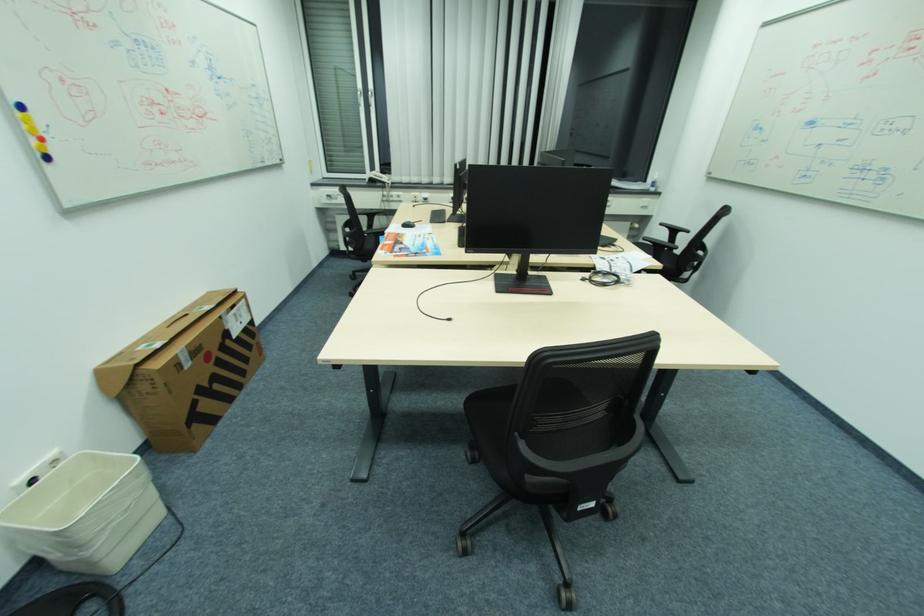
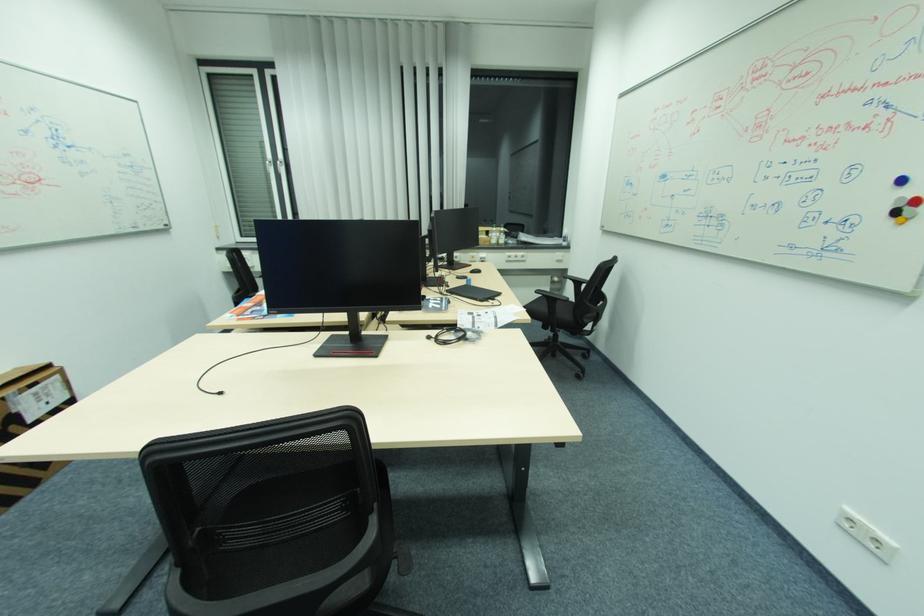
In the second image, find the point that corresponds to point (225, 317) in the first image.

(7, 399)